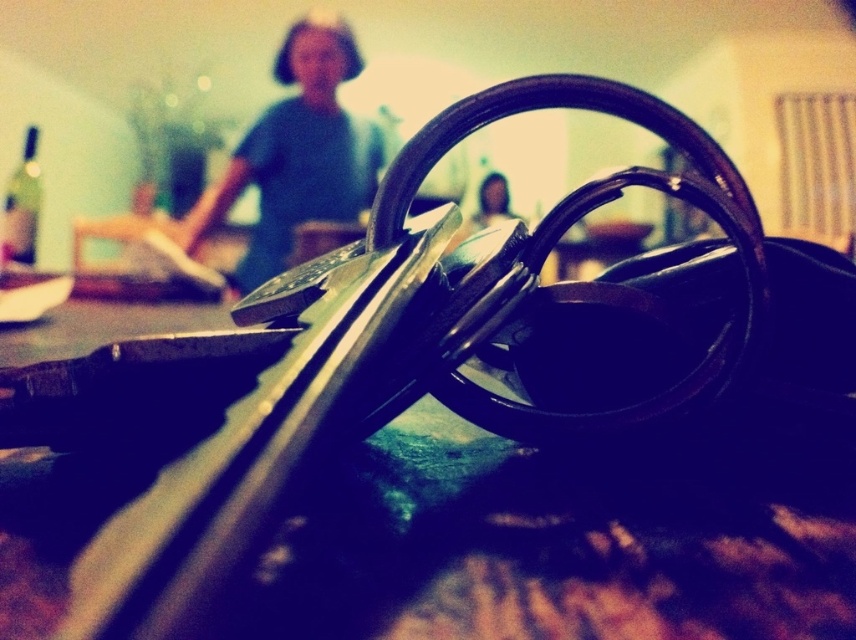
You are a photographer adjusting your camera settings to capture the metallic black keys at center and the smooth skin face at center in the same frame. Which object should you focus on first if you want the closer one to be in sharp focus?

The metallic black keys at center should be focused on first because it is closer to the camera than the smooth skin face at center, ensuring sharp focus on the nearer object.

You are a photographer trying to capture a clear portrait of the person in the image. The blue fabric shirt at upper center and the smooth skin face at center are both in the frame. Which object should you focus on to ensure the subject is sharp, considering their sizes?

The blue fabric shirt at upper center has a larger size compared to the smooth skin face at center. To ensure the subject is sharp, focus on the blue fabric shirt at upper center since it is larger and more prominent in the frame.